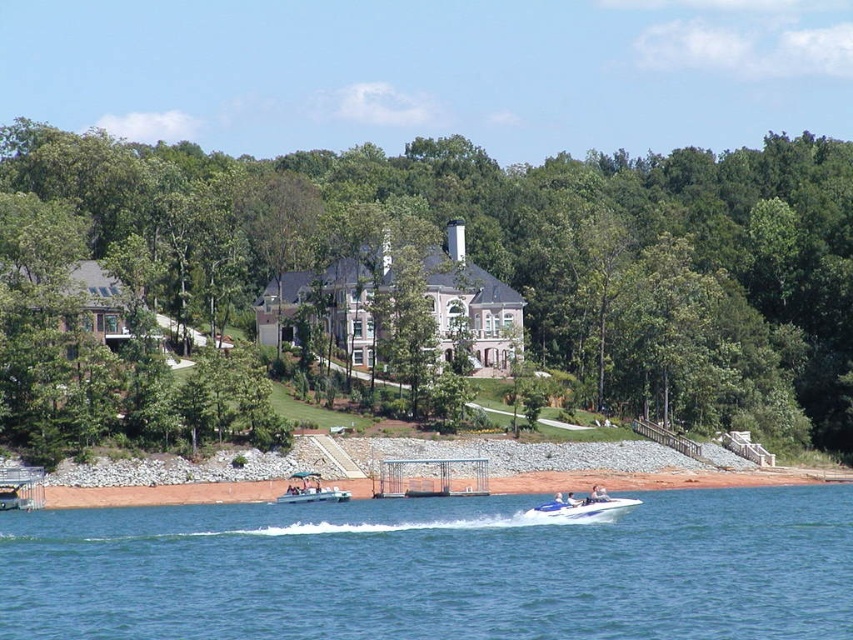
Locate an element on the screen. Image resolution: width=853 pixels, height=640 pixels. green leafy tree at center is located at coordinates (538, 252).

Locate an element on the screen. This screenshot has width=853, height=640. green leafy tree at center is located at coordinates (538, 252).

At what (x,y) coordinates should I click in order to perform the action: click on blue water at lower center. Please return your answer as a coordinate pair (x, y). Looking at the image, I should click on (436, 570).

You are a GUI agent. You are given a task and a screenshot of the screen. Output one action in this format:
    pyautogui.click(x=<x>, y=<y>)
    Task: Click on the blue water at lower center
    This screenshot has width=853, height=640.
    Given the screenshot: What is the action you would take?
    pyautogui.click(x=436, y=570)

Identify the location of green leafy tree at center. The height and width of the screenshot is (640, 853). (538, 252).

Between green leafy tree at center and white plastic boat at center, which one has more height?

With more height is green leafy tree at center.

Locate an element on the screen. This screenshot has height=640, width=853. green leafy tree at center is located at coordinates (538, 252).

Identify the location of green leafy tree at center. Image resolution: width=853 pixels, height=640 pixels. (538, 252).